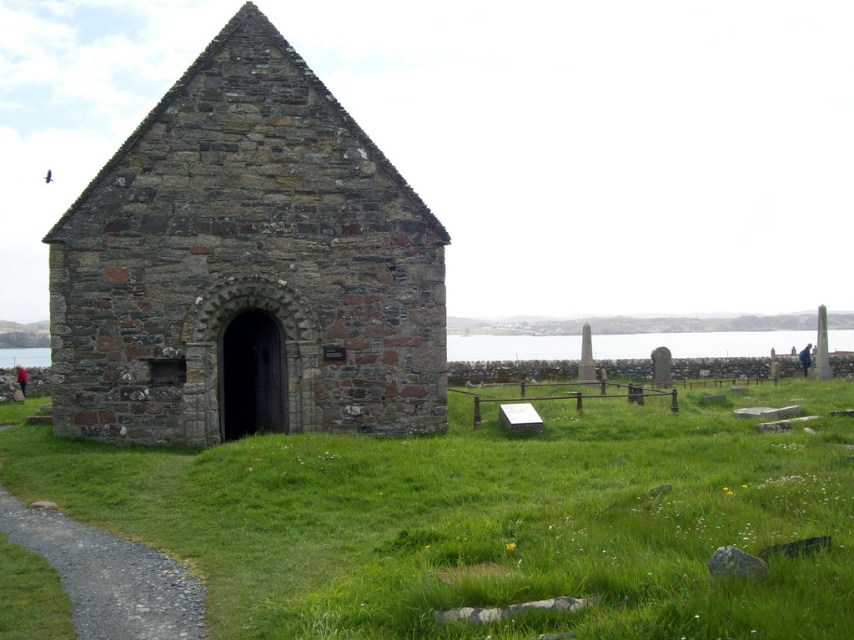
Between point (390, 224) and point (92, 548), which one is positioned in front?

Point (92, 548) is in front.

Where is `rustic stone church at center`? rustic stone church at center is located at coordinates (246, 268).

The width and height of the screenshot is (854, 640). Find the location of `rustic stone church at center`. rustic stone church at center is located at coordinates (246, 268).

Find the location of a particular element. rustic stone church at center is located at coordinates (246, 268).

Can you confirm if green grassy at center is thinner than rustic stone church at center?

No, green grassy at center is not thinner than rustic stone church at center.

Can you confirm if green grassy at center is smaller than rustic stone church at center?

Actually, green grassy at center might be larger than rustic stone church at center.

In order to click on green grassy at center in this screenshot , I will do `click(488, 518)`.

Locate an element on the screen. green grassy at center is located at coordinates (488, 518).

Is gravel path at lower left positioned before transparent water at center?

That is True.

What do you see at coordinates (108, 577) in the screenshot?
I see `gravel path at lower left` at bounding box center [108, 577].

The width and height of the screenshot is (854, 640). Identify the location of gravel path at lower left. (108, 577).